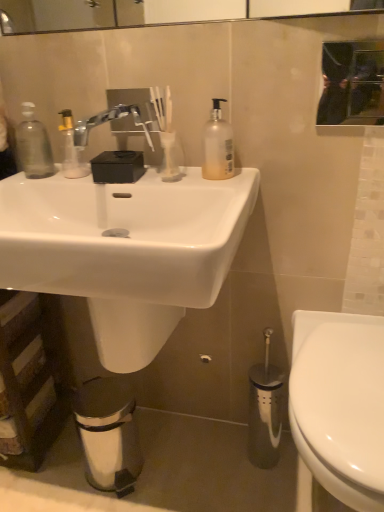
Question: From the image's perspective, is black glass mirror at upper center positioned above or below white glossy sink at center?

Choices:
 (A) below
 (B) above

Answer: (B)

Question: Looking at their shapes, would you say black glass mirror at upper center is wider or thinner than white glossy sink at center?

Choices:
 (A) thin
 (B) wide

Answer: (A)

Question: Estimate the real-world distances between objects in this image. Which object is farther from the white glossy sink at center?

Choices:
 (A) transparent plastic soap dispenser at left
 (B) black glass mirror at upper center
 (C) translucent plastic pump bottle at upper center
 (D) white glossy toilet at lower right
 (E) satin nickel faucet at upper center

Answer: (B)

Question: Estimate the real-world distances between objects in this image. Which object is closer to the satin nickel faucet at upper center?

Choices:
 (A) transparent plastic soap dispenser at left
 (B) translucent plastic pump bottle at upper center
 (C) white glossy sink at center
 (D) black glass mirror at upper center
 (E) white glossy toilet at lower right

Answer: (A)